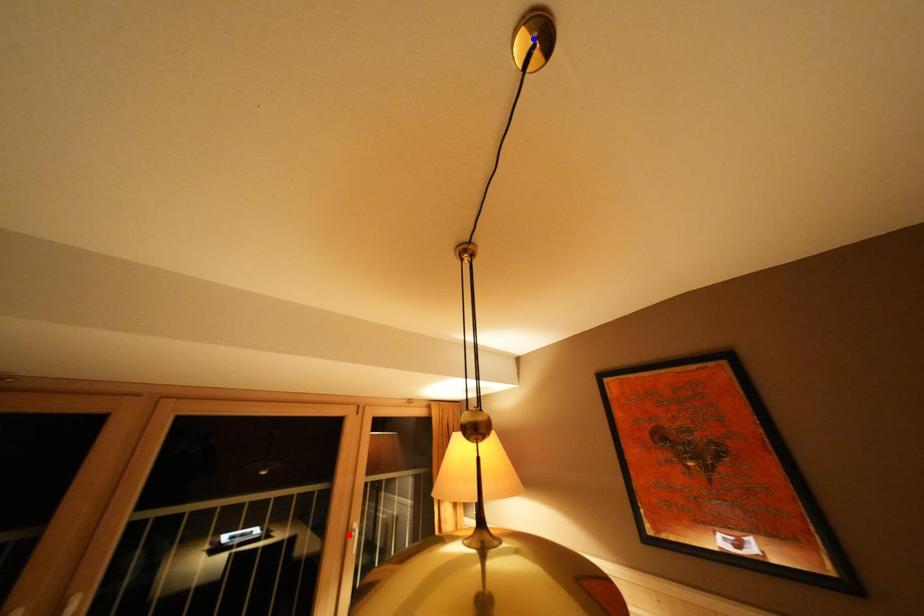
Question: Which of the two points in the image is closer to the camera?

Choices:
 (A) Blue point is closer.
 (B) Red point is closer.

Answer: (A)